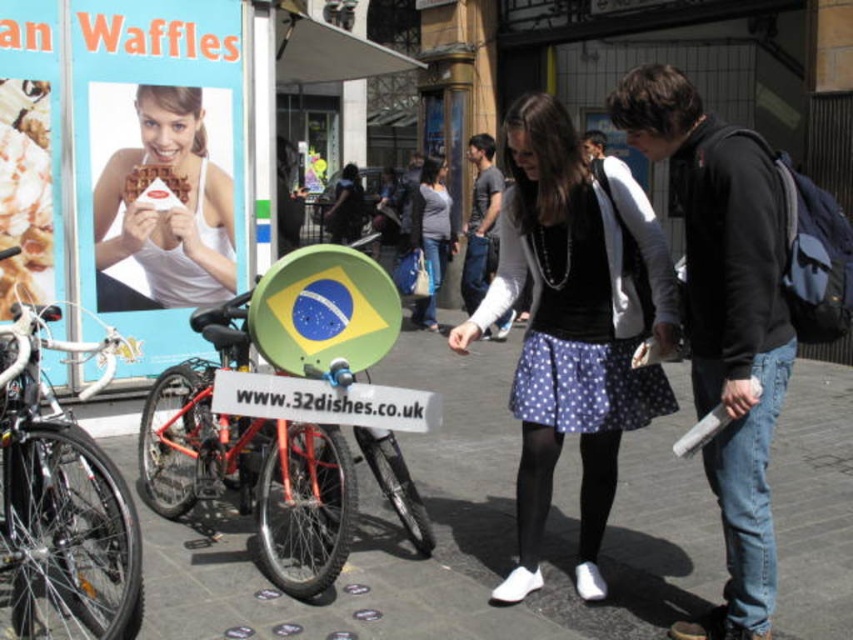
You are standing at the center of the urban street scene. There is a point marked at coordinates (x=724, y=320). What is located at that point?

At point (x=724, y=320) lies dark blue jeans at center.

You are a photographer standing at the center of the urban street scene. You want to take a photo of the promotional display for 32dishes.co.uk. Which of the two points, point (604, 480) or point (422, 180), should you focus on to ensure the closer one is in sharp focus?

Point (604, 480) is closer to the camera than point (422, 180), so you should focus on point (604, 480) to ensure the closer one is in sharp focus.